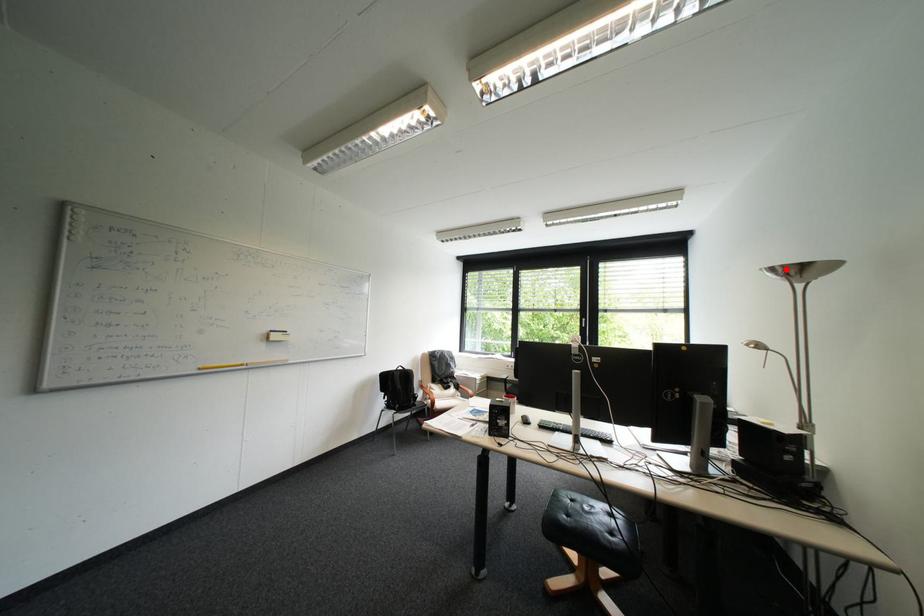
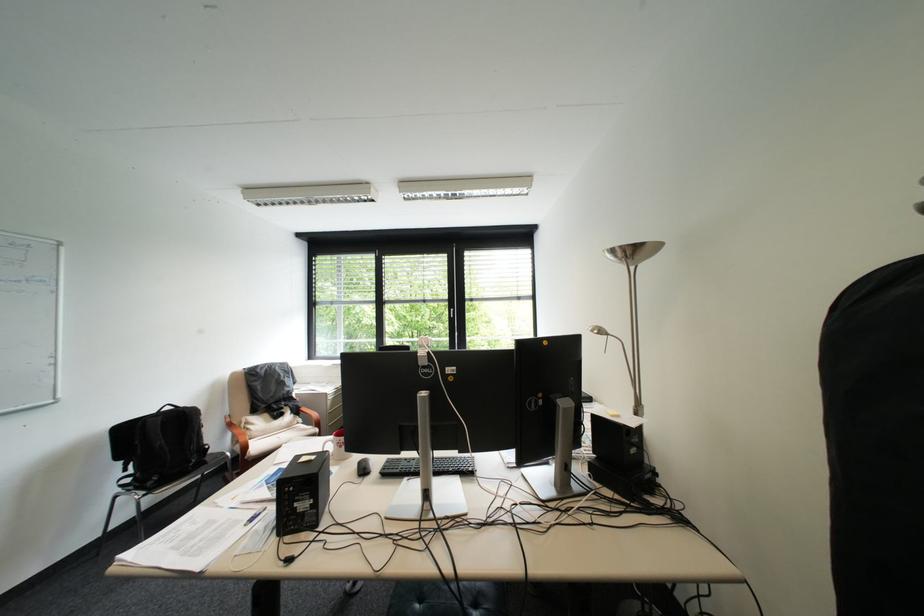
The point at the highlighted location is marked in the first image. Where is the corresponding point in the second image?

(625, 252)